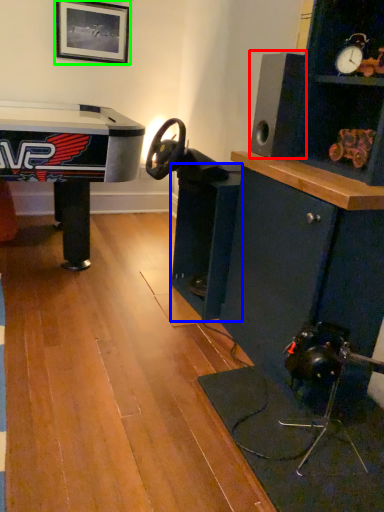
Question: Which is farther away from speaker (highlighted by a red box)? shelf (highlighted by a blue box) or picture frame (highlighted by a green box)?

Choices:
 (A) shelf
 (B) picture frame

Answer: (B)